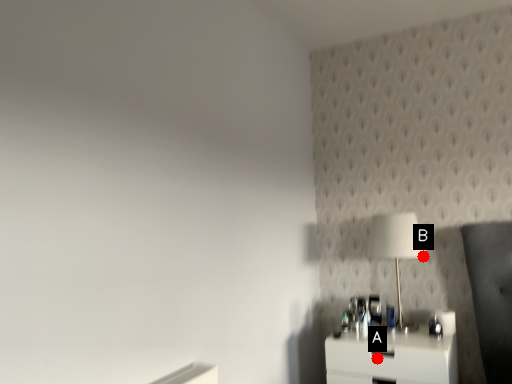
Question: Two points are circled on the image, labeled by A and B beside each circle. Which point appears farthest from the camera in this image?

Choices:
 (A) A is further
 (B) B is further

Answer: (B)